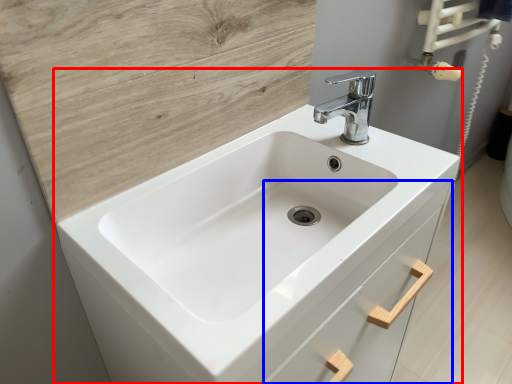
Question: Among these objects, which one is farthest to the camera, sink (highlighted by a red box) or drawer (highlighted by a blue box)?

Choices:
 (A) sink
 (B) drawer

Answer: (B)